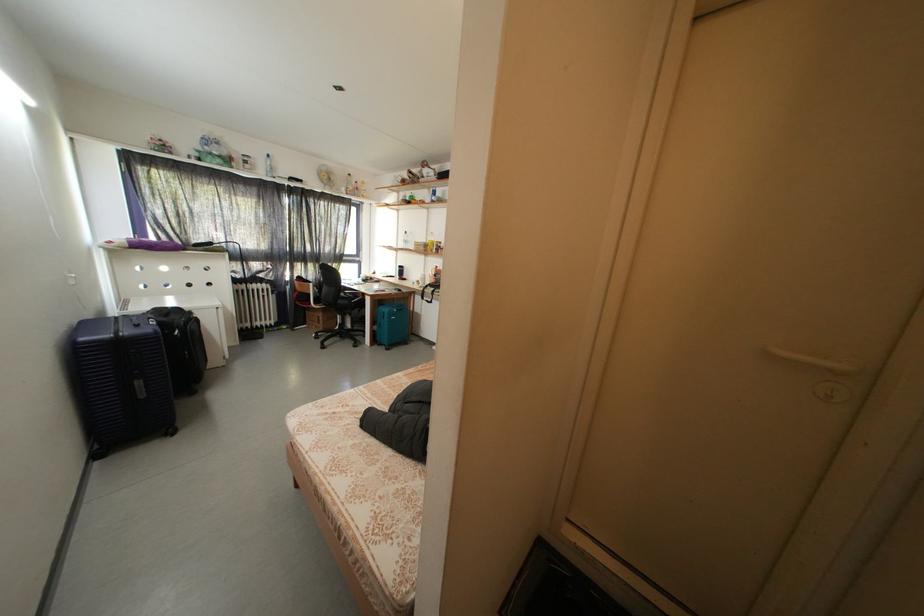
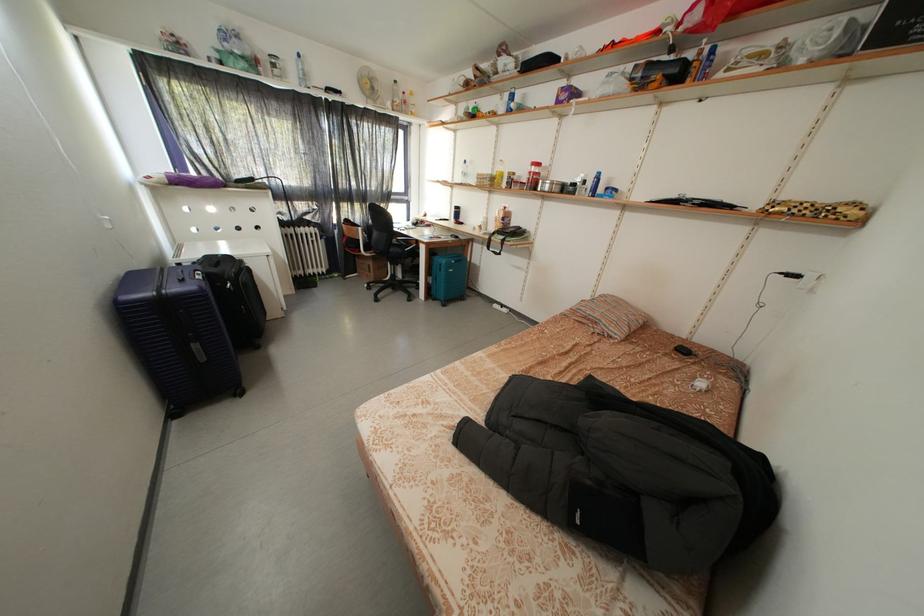
In a continuous first-person perspective shot, in which direction is the camera moving?

The movement direction of the cameraman is left, forward.